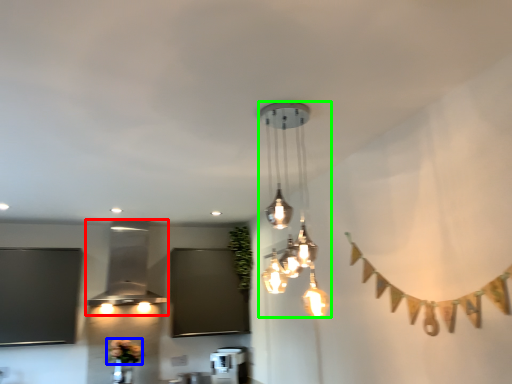
Question: Estimate the real-world distances between objects in this image. Which object is closer to lamp (highlighted by a red box), flower (highlighted by a blue box) or lamp (highlighted by a green box)?

Choices:
 (A) flower
 (B) lamp

Answer: (A)